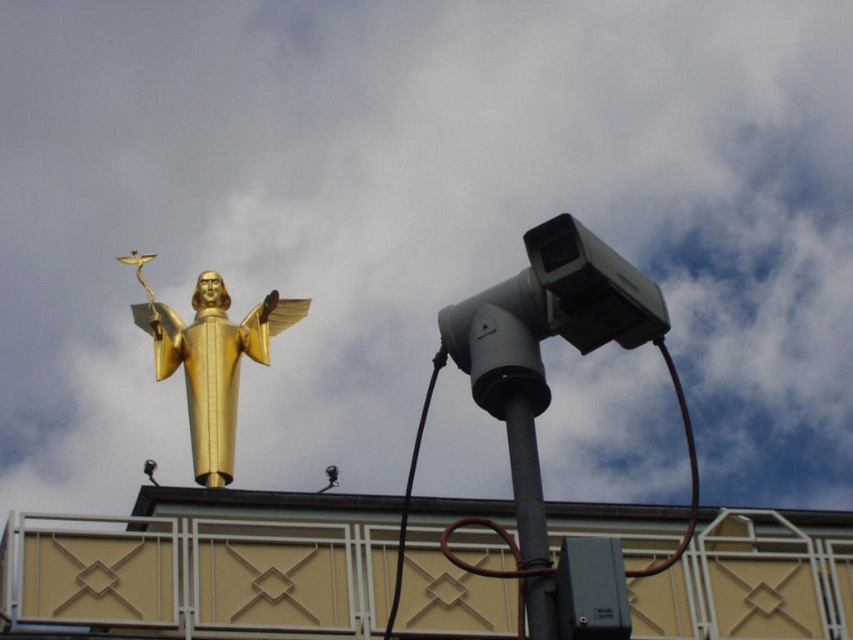
You are an art student analyzing the composition of the image. You notice the gold polished statue at upper left and the black metallic pole at center. Which object is located to the right of the other?

The black metallic pole at center is located to the right of the gold polished statue at upper left because the gold polished statue at upper left is positioned on the left side of the black metallic pole at center.

You are an architect designing a new museum exhibit. You need to place a new display case between the gold polished statue at upper left and the black metallic pole at center. Which object should the display case be closer to if it must be placed closer to the wider object?

The display case should be placed closer to the gold polished statue at upper left because its width surpasses that of the black metallic pole at center, as stated in the description.

You are a photographer standing in front of the gold polished statue at upper left and the black metallic pole at center. You want to capture a photo where both objects are visible. Which object should you position closer to the camera to ensure the statue is in focus while the pole remains in the background?

To ensure the gold polished statue at upper left is in focus while the black metallic pole at center is in the background, position the camera closer to the statue. Since the statue is above the pole, adjusting the focus point towards the statue will keep it sharp while the pole, being further away, will naturally fall into the background.